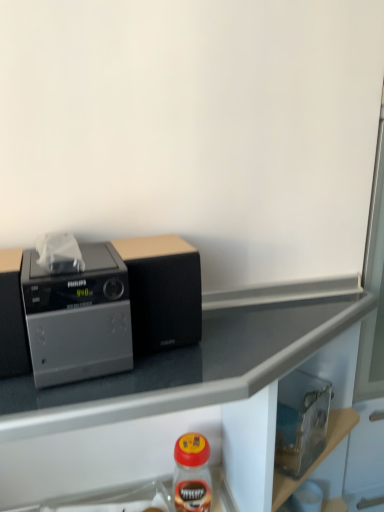
Question: Is metallic gray countertop at upper left facing away from black matte speaker at center?

Choices:
 (A) no
 (B) yes

Answer: (A)

Question: Can you confirm if metallic gray countertop at upper left is taller than black matte speaker at center?

Choices:
 (A) no
 (B) yes

Answer: (B)

Question: Can you confirm if metallic gray countertop at upper left is positioned to the right of black matte speaker at center?

Choices:
 (A) no
 (B) yes

Answer: (B)

Question: From the image's perspective, is metallic gray countertop at upper left located beneath black matte speaker at center?

Choices:
 (A) yes
 (B) no

Answer: (A)

Question: Is metallic gray countertop at upper left far away from black matte speaker at center?

Choices:
 (A) yes
 (B) no

Answer: (B)

Question: Does point (352, 295) appear closer or farther from the camera than point (137, 252)?

Choices:
 (A) farther
 (B) closer

Answer: (A)

Question: Based on their sizes in the image, would you say metallic gray countertop at upper left is bigger or smaller than black matte speaker at center?

Choices:
 (A) big
 (B) small

Answer: (A)

Question: In terms of width, does metallic gray countertop at upper left look wider or thinner when compared to black matte speaker at center?

Choices:
 (A) thin
 (B) wide

Answer: (B)

Question: Considering their positions, is metallic gray countertop at upper left located in front of or behind black matte speaker at center?

Choices:
 (A) behind
 (B) front

Answer: (B)

Question: From the image's perspective, is black matte speaker at center located above or below metallic gray countertop at upper left?

Choices:
 (A) below
 (B) above

Answer: (B)

Question: Considering their positions, is black matte speaker at center located in front of or behind metallic gray countertop at upper left?

Choices:
 (A) behind
 (B) front

Answer: (A)

Question: In terms of height, does black matte speaker at center look taller or shorter compared to metallic gray countertop at upper left?

Choices:
 (A) tall
 (B) short

Answer: (B)

Question: Is point (142, 329) closer or farther from the camera than point (76, 455)?

Choices:
 (A) farther
 (B) closer

Answer: (B)

Question: From the image's perspective, relative to metallic gray countertop at upper left, is satin silver radio at left above or below?

Choices:
 (A) below
 (B) above

Answer: (B)

Question: Which is correct: satin silver radio at left is inside metallic gray countertop at upper left, or outside of it?

Choices:
 (A) inside
 (B) outside

Answer: (B)